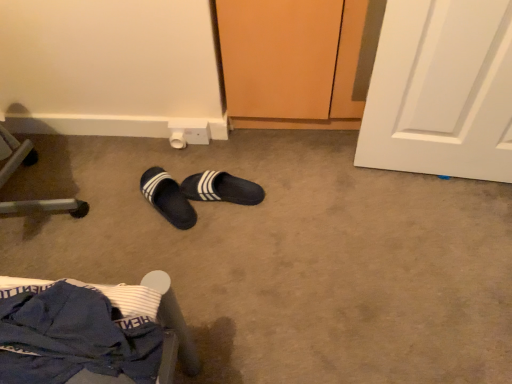
Question: Looking at their shapes, would you say black fabric slippers at center, the 2th footwear in the left-to-right sequence, is wider or thinner than black fuzzy slippers at center, the 2th footwear when ordered from right to left?

Choices:
 (A) thin
 (B) wide

Answer: (A)

Question: Is black fabric slippers at center, the 2th footwear in the left-to-right sequence, spatially inside black fuzzy slippers at center, the 2th footwear when ordered from right to left, or outside of it?

Choices:
 (A) outside
 (B) inside

Answer: (A)

Question: Based on their relative distances, which object is nearer to the blue fabric chair at lower left?

Choices:
 (A) black fabric slippers at center, the 2th footwear in the left-to-right sequence
 (B) black fuzzy slippers at center, the 2th footwear when ordered from right to left

Answer: (B)

Question: Which object is the farthest from the black fabric slippers at center, the 2th footwear in the left-to-right sequence?

Choices:
 (A) blue fabric chair at lower left
 (B) black fuzzy slippers at center, which is counted as the first footwear, starting from the left

Answer: (A)